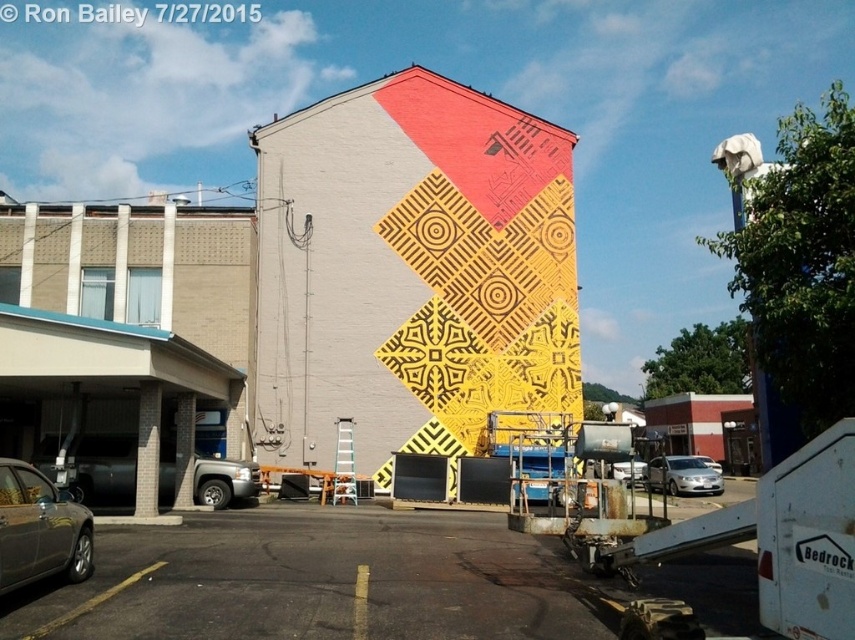
Is silver metallic sedan at lower right positioned behind silver metallic sedan at center?

No, silver metallic sedan at lower right is closer to the viewer.

Between silver metallic sedan at lower right and silver metallic sedan at center, which one appears on the left side from the viewer's perspective?

silver metallic sedan at lower right

What are the coordinates of `silver metallic sedan at lower right` in the screenshot? It's located at (682, 476).

In the scene shown: Who is more forward, (39,499) or (706,465)?

Positioned in front is point (39,499).

Does point (44, 497) come in front of point (705, 458)?

Yes, it is.

The image size is (855, 640). Find the location of `metallic gray sedan at lower left`. metallic gray sedan at lower left is located at coordinates (39, 529).

Which is in front, point (71, 483) or point (635, 467)?

Point (71, 483) is more forward.

Is metallic silver truck at left smaller than silver metallic car at center?

Yes.

What do you see at coordinates (102, 468) in the screenshot? I see `metallic silver truck at left` at bounding box center [102, 468].

You are a GUI agent. You are given a task and a screenshot of the screen. Output one action in this format:
    pyautogui.click(x=<x>, y=<y>)
    Task: Click on the metallic silver truck at left
    The image size is (855, 640).
    Given the screenshot: What is the action you would take?
    pyautogui.click(x=102, y=468)